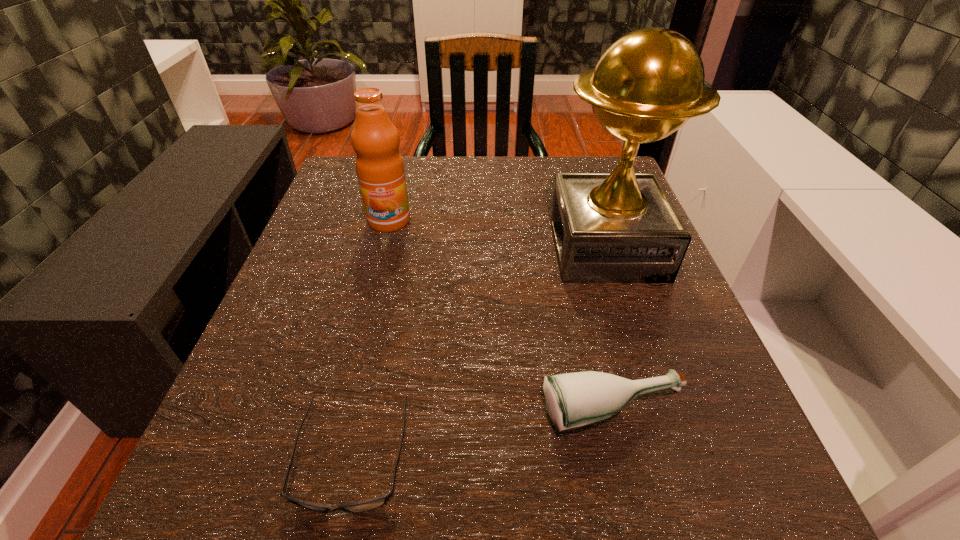
This screenshot has height=540, width=960. In the image, there is a desktop. Find the location of `free space at the near left corner`. free space at the near left corner is located at coordinates (288, 504).

Where is `blank area at the far right corner`? blank area at the far right corner is located at coordinates (586, 173).

Locate an element on the screen. This screenshot has width=960, height=540. vacant space at the near right corner is located at coordinates (744, 525).

This screenshot has height=540, width=960. Find the location of `free space between the tallest object and the third tallest object`. free space between the tallest object and the third tallest object is located at coordinates (610, 331).

Locate an element on the screen. This screenshot has width=960, height=540. empty space between the fruit juice and the shortest object is located at coordinates (371, 340).

Where is `empty space that is in between the third tallest object and the second tallest object`? The width and height of the screenshot is (960, 540). empty space that is in between the third tallest object and the second tallest object is located at coordinates (501, 318).

Locate an element on the screen. This screenshot has height=540, width=960. empty location between the second tallest object and the sunglasses is located at coordinates (371, 340).

Where is `free spot between the bottle and the sunglasses`? free spot between the bottle and the sunglasses is located at coordinates (483, 436).

Find the location of a particular element. The height and width of the screenshot is (540, 960). vacant point located between the shortest object and the second tallest object is located at coordinates (371, 340).

Locate an element on the screen. Image resolution: width=960 pixels, height=540 pixels. vacant space that is in between the tallest object and the second tallest object is located at coordinates (497, 234).